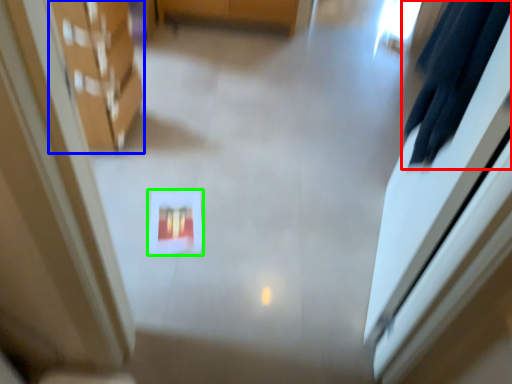
Question: Which object is the farthest from robe (highlighted by a red box)? Choose among these: furniture (highlighted by a blue box) or square (highlighted by a green box).

Choices:
 (A) furniture
 (B) square

Answer: (A)